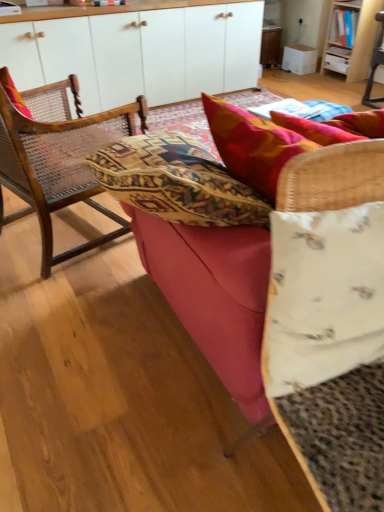
Question: Is point (334, 141) closer or farther from the camera than point (357, 22)?

Choices:
 (A) closer
 (B) farther

Answer: (A)

Question: From the image's perspective, is textured red pillow at upper right, the second pillow when ordered from bottom to top, positioned above or below wooden bookshelf at upper right?

Choices:
 (A) below
 (B) above

Answer: (A)

Question: Which of these objects is positioned farthest from the textured red pillow at upper right, which ranks as the second pillow in front-to-back order?

Choices:
 (A) woven wood chair at left
 (B) white matte cabinet at upper center
 (C) white fabric pillow at center, which is the second pillow in back-to-front order
 (D) velvet red couch at center
 (E) wooden cabinet at upper center

Answer: (E)

Question: Based on their relative distances, which object is farther from the velvet red couch at center?

Choices:
 (A) white matte cabinet at upper center
 (B) wooden bookshelf at upper right
 (C) woven wood chair at left
 (D) textured red pillow at upper right, which ranks as the 1th pillow in top-to-bottom order
 (E) white fabric pillow at center, the first pillow when ordered from front to back

Answer: (B)